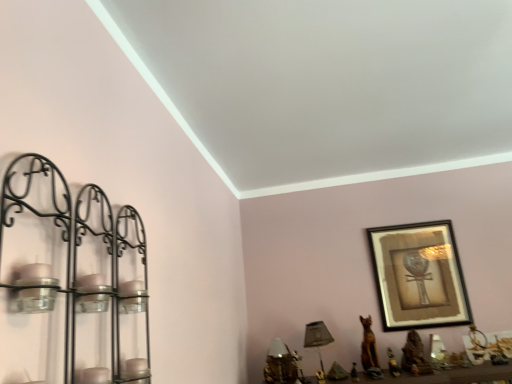
Question: Is gold metallic table lamp at lower center, positioned as the 2th table lamp in right-to-left order, a part of wooden framed picture at upper right?

Choices:
 (A) yes
 (B) no

Answer: (B)

Question: Is there a large distance between wooden framed picture at upper right and gold metallic table lamp at lower center, the first table lamp viewed from the left?

Choices:
 (A) no
 (B) yes

Answer: (A)

Question: Is wooden framed picture at upper right wider than gold metallic table lamp at lower center, the first table lamp viewed from the left?

Choices:
 (A) no
 (B) yes

Answer: (A)

Question: Does wooden framed picture at upper right have a lesser width compared to gold metallic table lamp at lower center, the first table lamp viewed from the left?

Choices:
 (A) yes
 (B) no

Answer: (A)

Question: Is wooden framed picture at upper right outside of gold metallic table lamp at lower center, positioned as the 2th table lamp in right-to-left order?

Choices:
 (A) yes
 (B) no

Answer: (A)

Question: Considering their positions, is gold metallic table lamp at lower center, positioned as the 2th table lamp in right-to-left order, located in front of or behind wooden framed picture at upper right?

Choices:
 (A) behind
 (B) front

Answer: (B)

Question: Considering the positions of gold metallic table lamp at lower center, the first table lamp viewed from the left, and wooden framed picture at upper right in the image, is gold metallic table lamp at lower center, the first table lamp viewed from the left, wider or thinner than wooden framed picture at upper right?

Choices:
 (A) wide
 (B) thin

Answer: (A)

Question: Is point (268, 357) positioned closer to the camera than point (462, 306)?

Choices:
 (A) closer
 (B) farther

Answer: (A)

Question: In the image, is gold metallic table lamp at lower center, positioned as the 2th table lamp in right-to-left order, on the left side or the right side of wooden framed picture at upper right?

Choices:
 (A) left
 (B) right

Answer: (A)

Question: Is green fabric table lamp at lower center, the 1th table lamp in the right-to-left sequence, spatially inside black metal candle holder at left, or outside of it?

Choices:
 (A) outside
 (B) inside

Answer: (A)

Question: Is green fabric table lamp at lower center, which is the second table lamp in left-to-right order, to the left or to the right of black metal candle holder at left in the image?

Choices:
 (A) right
 (B) left

Answer: (A)

Question: From their relative heights in the image, would you say green fabric table lamp at lower center, the 1th table lamp in the right-to-left sequence, is taller or shorter than black metal candle holder at left?

Choices:
 (A) short
 (B) tall

Answer: (A)

Question: In terms of size, does green fabric table lamp at lower center, the 1th table lamp in the right-to-left sequence, appear bigger or smaller than black metal candle holder at left?

Choices:
 (A) small
 (B) big

Answer: (A)

Question: In terms of width, does gold metallic table lamp at lower center, positioned as the 2th table lamp in right-to-left order, look wider or thinner when compared to green fabric table lamp at lower center, which is the second table lamp in left-to-right order?

Choices:
 (A) wide
 (B) thin

Answer: (B)

Question: From a real-world perspective, is gold metallic table lamp at lower center, the first table lamp viewed from the left, positioned above or below green fabric table lamp at lower center, the 1th table lamp in the right-to-left sequence?

Choices:
 (A) above
 (B) below

Answer: (B)